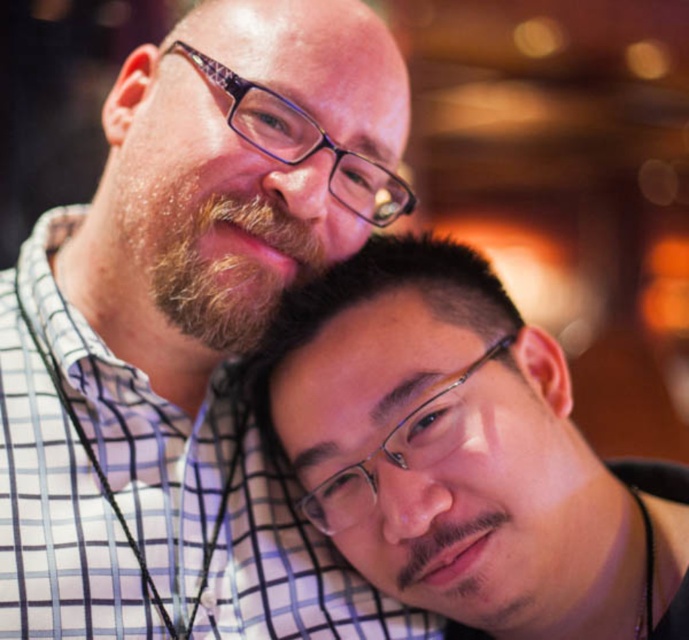
In the scene shown: You are designing a layout for a magazine cover and need to place two elements based on their sizes. The elements are the matte black shirt at upper left and the brown fuzzy beard at upper left. Given their sizes, which element should you allocate more space to in your design?

The matte black shirt at upper left should be allocated more space in the design since its width is larger than the brown fuzzy beard at upper left.

What is the color of the shirt at the location of point (192,332)?

The point (192,332) is on a matte black shirt at upper left.